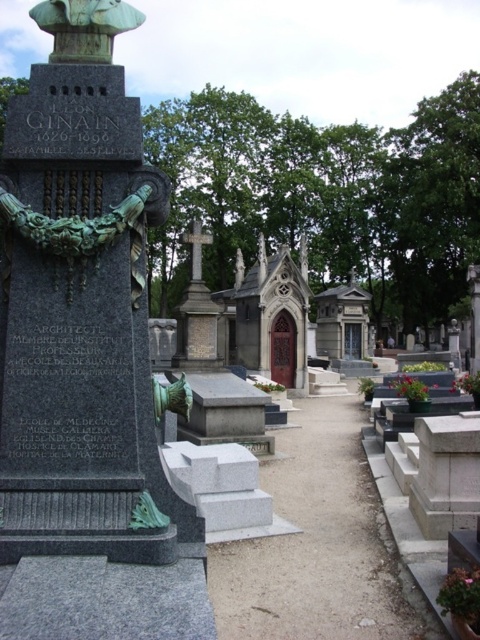
Which of these two, bronze/bronzed stone monument at center or green patina statue at upper left, stands shorter?

Standing shorter between the two is green patina statue at upper left.

Describe the element at coordinates (80, 305) in the screenshot. I see `bronze/bronzed stone monument at center` at that location.

You are a GUI agent. You are given a task and a screenshot of the screen. Output one action in this format:
    pyautogui.click(x=<x>, y=<y>)
    Task: Click on the bronze/bronzed stone monument at center
    The width and height of the screenshot is (480, 640).
    Given the screenshot: What is the action you would take?
    pyautogui.click(x=80, y=305)